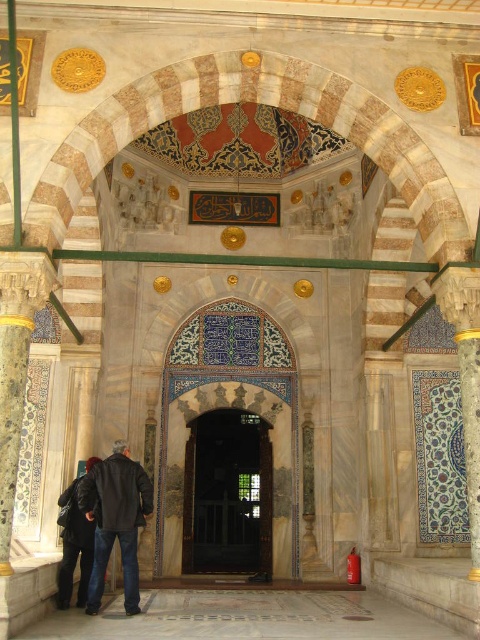
Who is higher up, wooden door at center or blue glazed tile at center?

blue glazed tile at center is above.

In the scene shown: Can you confirm if wooden door at center is positioned to the left of blue glazed tile at center?

Correct, you'll find wooden door at center to the left of blue glazed tile at center.

What do you see at coordinates (228, 496) in the screenshot?
I see `wooden door at center` at bounding box center [228, 496].

You are a GUI agent. You are given a task and a screenshot of the screen. Output one action in this format:
    pyautogui.click(x=<x>, y=<y>)
    Task: Click on the wooden door at center
    This screenshot has width=480, height=640.
    Given the screenshot: What is the action you would take?
    pyautogui.click(x=228, y=496)

Locate an element on the screen. This screenshot has width=480, height=640. wooden door at center is located at coordinates (228, 496).

Does point (192, 561) come closer to viewer compared to point (63, 572)?

No, it is behind (63, 572).

I want to click on wooden door at center, so click(228, 496).

How far apart are wooden door at center and dark gray leather jacket at center?

25.27 meters

Is point (192, 544) positioned in front of point (132, 468)?

No, (192, 544) is behind (132, 468).

Which is behind, point (211, 452) or point (124, 564)?

Point (211, 452)

The width and height of the screenshot is (480, 640). In order to click on wooden door at center in this screenshot , I will do `click(228, 496)`.